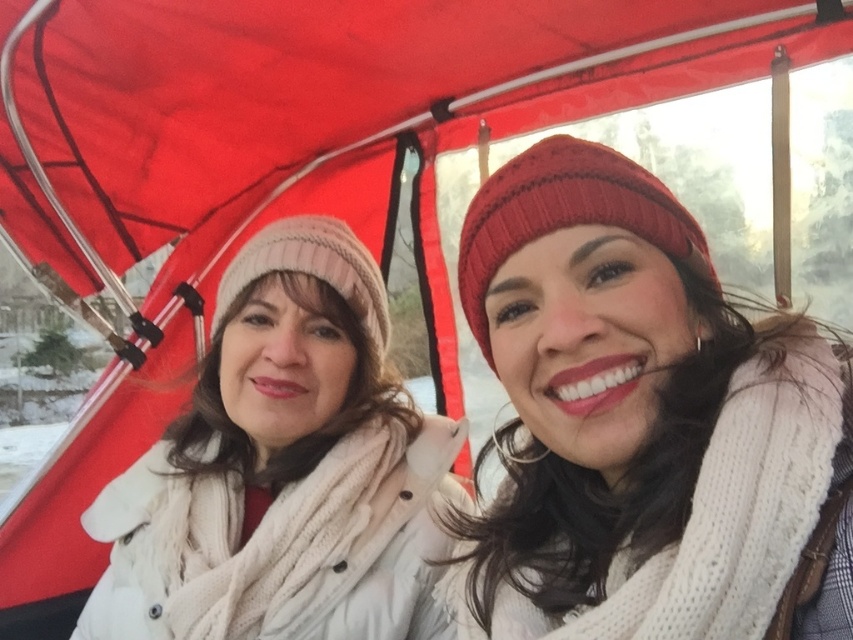
Which of these two, knitted red beanie at upper right or white knit hat at left, stands shorter?

With less height is knitted red beanie at upper right.

Is point (845, 465) more distant than point (154, 460)?

No, (845, 465) is closer to viewer.

The image size is (853, 640). Find the location of `knitted red beanie at upper right`. knitted red beanie at upper right is located at coordinates (642, 422).